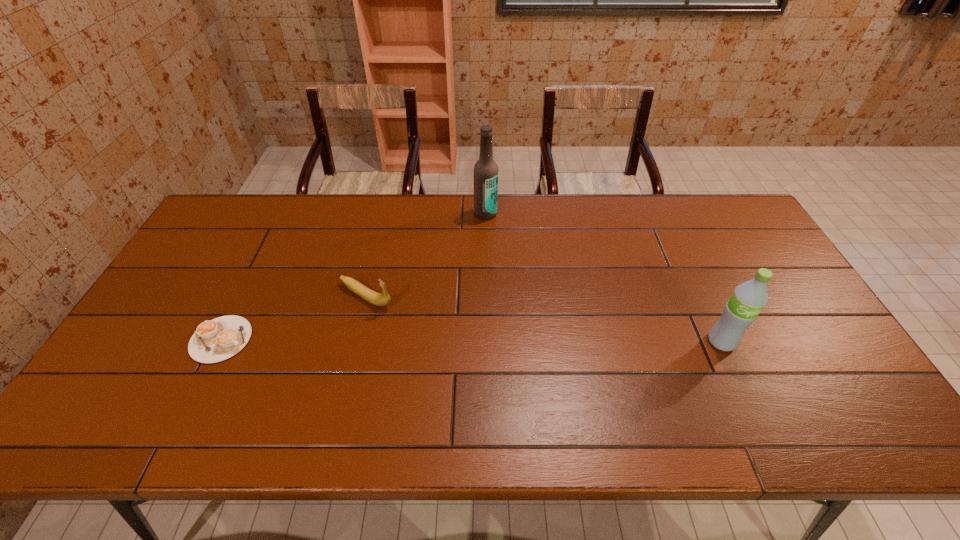
The height and width of the screenshot is (540, 960). Find the location of `vacant space in between the cappuccino and the second farthest object`. vacant space in between the cappuccino and the second farthest object is located at coordinates (294, 318).

Find the location of a particular element. vacant area that lies between the third tallest object and the cappuccino is located at coordinates (294, 318).

Locate an element on the screen. Image resolution: width=960 pixels, height=540 pixels. free space between the farthest object and the third shortest object is located at coordinates (604, 278).

Image resolution: width=960 pixels, height=540 pixels. What are the coordinates of `vacant space that is in between the farthest object and the second tallest object` in the screenshot? It's located at (604, 278).

This screenshot has width=960, height=540. In order to click on free point between the water bottle and the banana in this screenshot , I will do `click(543, 319)`.

You are a GUI agent. You are given a task and a screenshot of the screen. Output one action in this format:
    pyautogui.click(x=<x>, y=<y>)
    Task: Click on the object that ranks as the closest to the rightmost object
    The height and width of the screenshot is (540, 960).
    Given the screenshot: What is the action you would take?
    pyautogui.click(x=485, y=173)

Select which object is the second closest to the rightmost object. Please provide its 2D coordinates. Your answer should be formatted as a tuple, i.e. [(x, y)], where the tuple contains the x and y coordinates of a point satisfying the conditions above.

[(367, 294)]

Where is `vacant point that satisfies the following two spatial constraints: 1. on the front side of the rightmost object; 2. on the left side of the cappuccino`? Image resolution: width=960 pixels, height=540 pixels. vacant point that satisfies the following two spatial constraints: 1. on the front side of the rightmost object; 2. on the left side of the cappuccino is located at coordinates (220, 341).

Where is `free spot that satisfies the following two spatial constraints: 1. on the front side of the rightmost object; 2. on the left side of the third tallest object`? free spot that satisfies the following two spatial constraints: 1. on the front side of the rightmost object; 2. on the left side of the third tallest object is located at coordinates (355, 341).

Locate an element on the screen. free location that satisfies the following two spatial constraints: 1. on the front side of the beer bottle; 2. on the left side of the rightmost object is located at coordinates (488, 341).